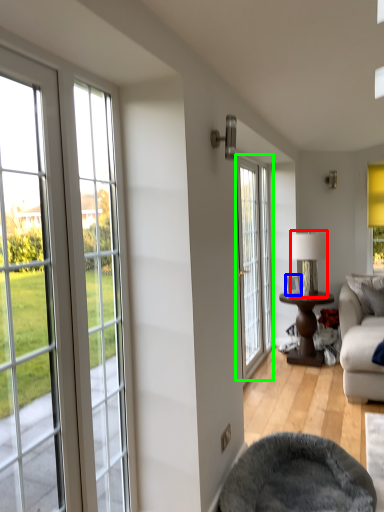
Question: Estimate the real-world distances between objects in this image. Which object is closer to lamp (highlighted by a red box), picture frame (highlighted by a blue box) or door (highlighted by a green box)?

Choices:
 (A) picture frame
 (B) door

Answer: (A)